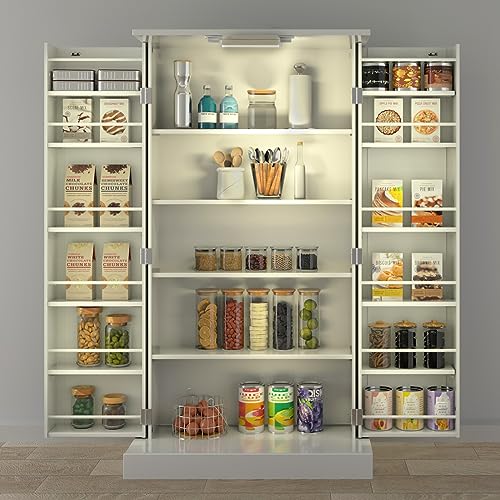
You are a GUI agent. You are given a task and a screenshot of the screen. Output one action in this format:
    pyautogui.click(x=<x>, y=<y>)
    Task: Click on the center shelves
    The height and width of the screenshot is (500, 500).
    Given the screenshot: What is the action you would take?
    pyautogui.click(x=242, y=360), pyautogui.click(x=254, y=272), pyautogui.click(x=241, y=203), pyautogui.click(x=238, y=128)